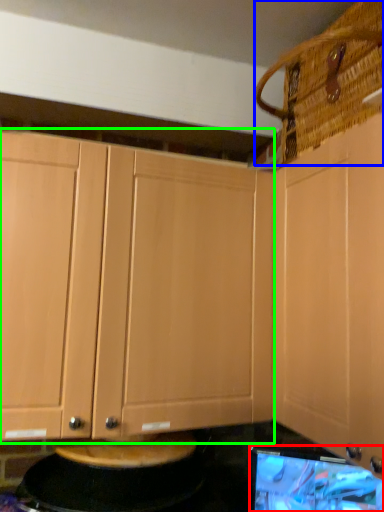
Question: Which object is the closest to the computer monitor (highlighted by a red box)? Choose among these: basket (highlighted by a blue box) or cabinetry (highlighted by a green box).

Choices:
 (A) basket
 (B) cabinetry

Answer: (B)